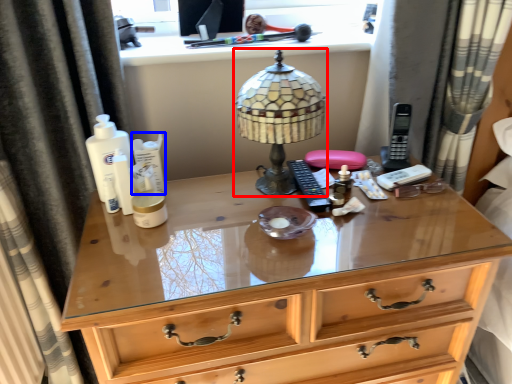
Question: Among these objects, which one is farthest to the camera, lamp (highlighted by a red box) or toiletry (highlighted by a blue box)?

Choices:
 (A) lamp
 (B) toiletry

Answer: (B)